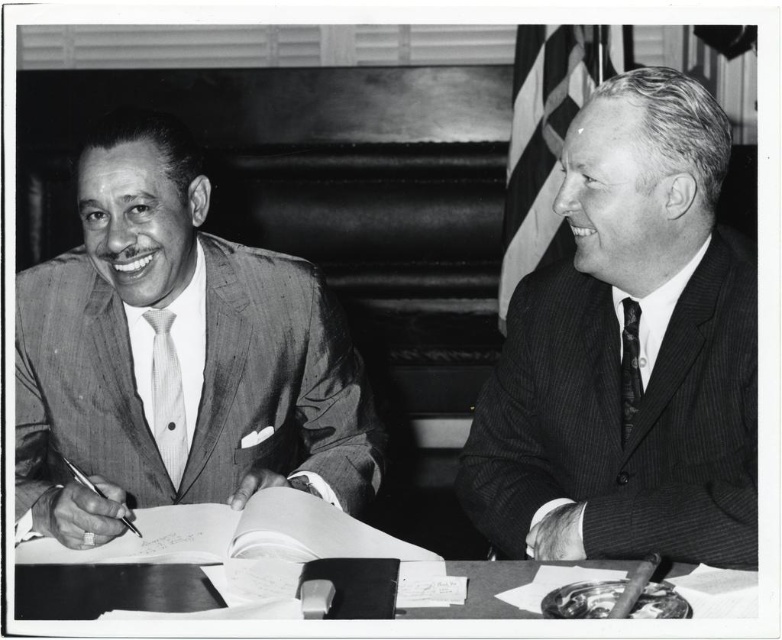
Question: Which of these objects is positioned closest to the pinstriped fabric tie at left?

Choices:
 (A) smooth wooden table at center
 (B) striped suit at left
 (C) pinstriped suit at right

Answer: (B)

Question: Does striped suit at left have a larger size compared to pinstriped fabric tie at left?

Choices:
 (A) no
 (B) yes

Answer: (B)

Question: Which of the following is the closest to the observer?

Choices:
 (A) pinstriped fabric tie at left
 (B) pinstriped suit at right
 (C) striped suit at left

Answer: (B)

Question: Does pinstriped fabric tie at left appear over black textured tie at right?

Choices:
 (A) no
 (B) yes

Answer: (A)

Question: Estimate the real-world distances between objects in this image. Which object is farther from the pinstriped fabric tie at left?

Choices:
 (A) black textured tie at right
 (B) striped suit at left

Answer: (A)

Question: Considering the relative positions of smooth wooden table at center and pinstriped fabric tie at left in the image provided, where is smooth wooden table at center located with respect to pinstriped fabric tie at left?

Choices:
 (A) left
 (B) right

Answer: (B)